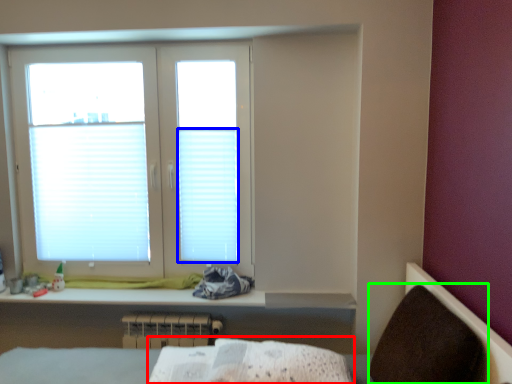
Question: Based on their relative distances, which object is nearer to sheet (highlighted by a red box)? Choose from blind (highlighted by a blue box) and armchair (highlighted by a green box).

Choices:
 (A) blind
 (B) armchair

Answer: (B)